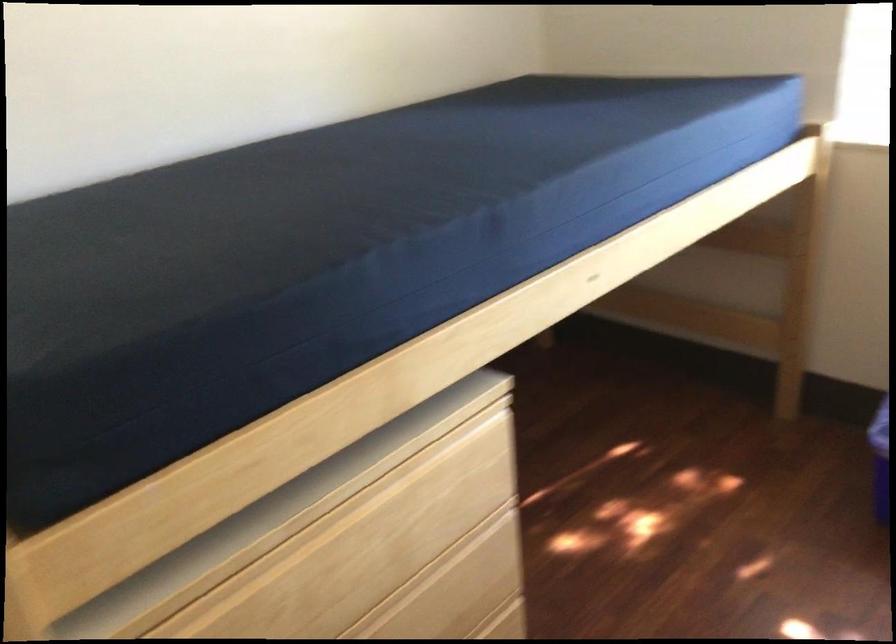
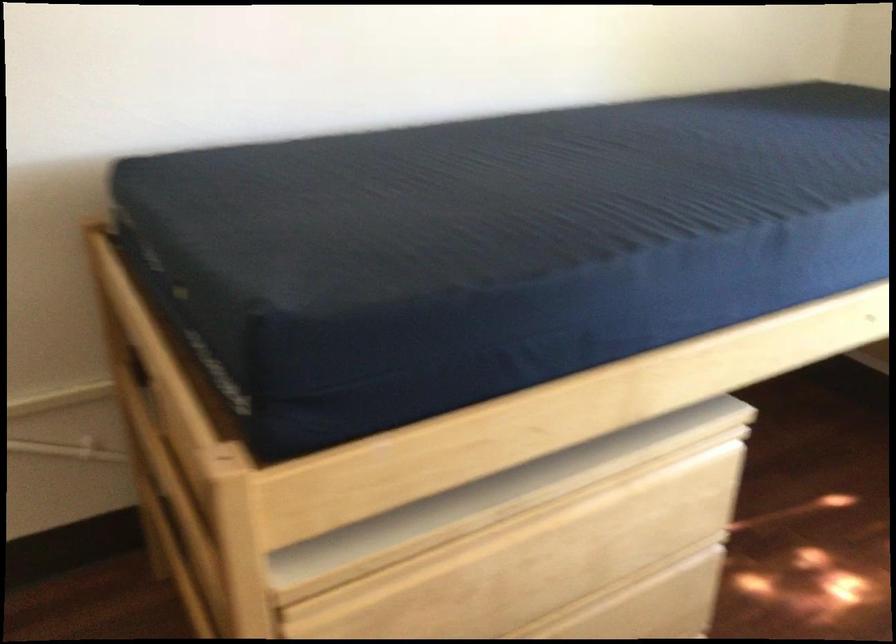
In a continuous first-person perspective shot, in which direction is the camera moving?

The cameraman walked toward left, forward.